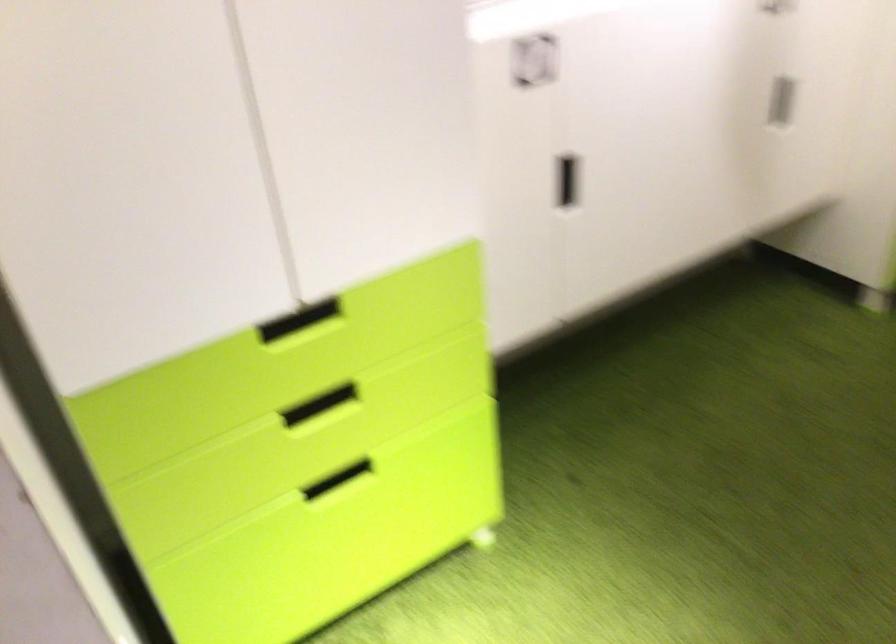
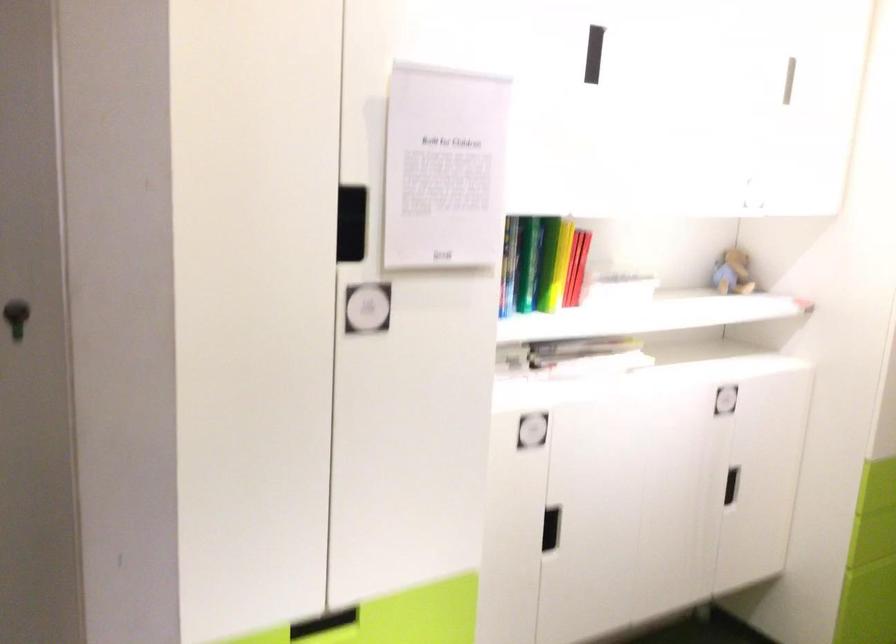
In the second image, find the point that corresponds to (x=312, y=323) in the first image.

(323, 623)